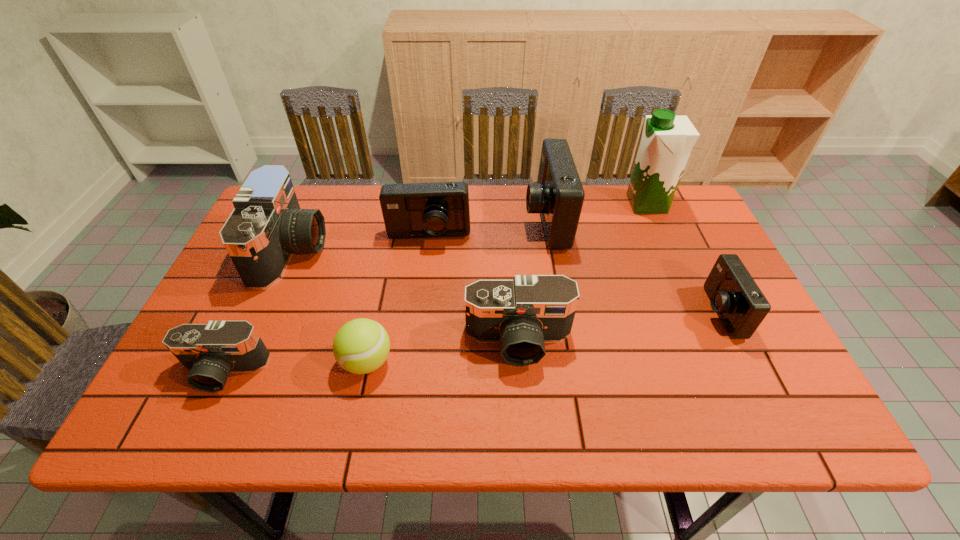
Image resolution: width=960 pixels, height=540 pixels. I want to click on object that is at the far right corner, so click(x=667, y=140).

I want to click on blank area at the far edge, so click(326, 212).

Locate an element on the screen. vacant space at the left edge of the desktop is located at coordinates (245, 292).

Identify the location of vacant area at the right edge. Image resolution: width=960 pixels, height=540 pixels. (713, 249).

Locate an element on the screen. free spot at the far left corner of the desktop is located at coordinates (303, 186).

In the image, there is a desktop. Where is `vacant region at the near left corner`? vacant region at the near left corner is located at coordinates tap(197, 399).

This screenshot has height=540, width=960. Identify the location of free space between the smallest blue camera and the leftmost blue camera. (574, 274).

Where is `unoccupied position between the biggest blue camera and the smallest black camera`? The width and height of the screenshot is (960, 540). unoccupied position between the biggest blue camera and the smallest black camera is located at coordinates (385, 295).

I want to click on vacant space that's between the smallest black camera and the nearest blue camera, so tap(471, 341).

In order to click on free space between the rightmost black camera and the green tennis ball in this screenshot , I will do `click(443, 352)`.